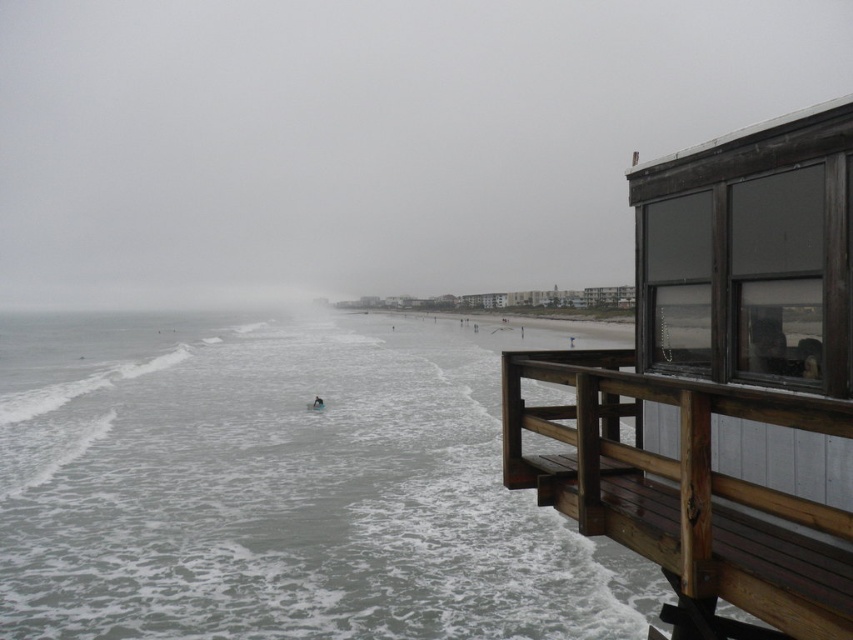
Question: Which point appears farthest from the camera in this image?

Choices:
 (A) (467, 579)
 (B) (321, 400)
 (C) (596, 240)

Answer: (C)

Question: Which of these objects is positioned farthest from the blue wetsuit surfer at center?

Choices:
 (A) brown wooden bench at right
 (B) gray matte water at lower left
 (C) transparent glass window at upper right

Answer: (C)

Question: Can you confirm if transparent glass window at upper right is bigger than blue wetsuit surfer at center?

Choices:
 (A) yes
 (B) no

Answer: (A)

Question: Which object is positioned closest to the transparent glass window at upper right?

Choices:
 (A) blue wetsuit surfer at center
 (B) gray matte water at lower left

Answer: (B)

Question: Can you confirm if brown wooden bench at right is positioned to the right of blue wetsuit surfer at center?

Choices:
 (A) no
 (B) yes

Answer: (B)

Question: Does brown wooden bench at right appear under blue wetsuit surfer at center?

Choices:
 (A) no
 (B) yes

Answer: (A)